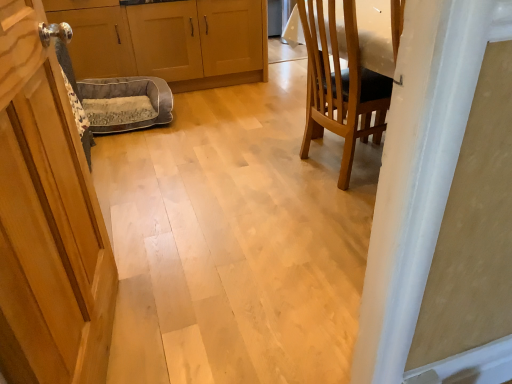
Identify the location of free spot behind wooden door at left. (174, 254).